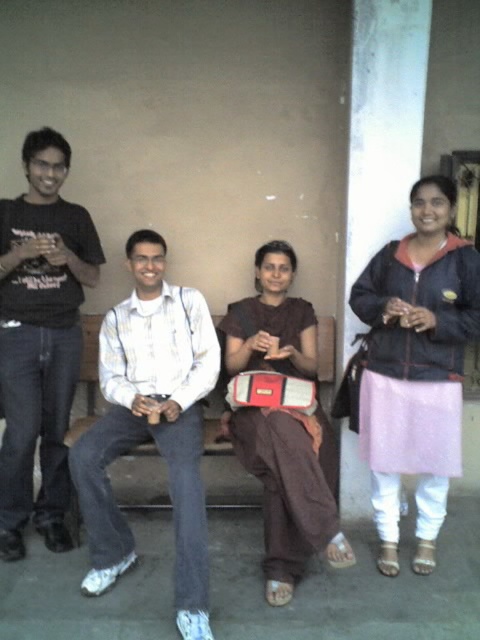
Question: Observing the image, what is the correct spatial positioning of white striped shirt at center in reference to brown fabric at center?

Choices:
 (A) above
 (B) below

Answer: (B)

Question: Among these objects, which one is nearest to the camera?

Choices:
 (A) brown fabric at center
 (B) white striped shirt at center
 (C) pink fabric skirt at right
 (D) black matte shirt at left

Answer: (B)

Question: Is black matte shirt at left positioned before brown fabric at center?

Choices:
 (A) no
 (B) yes

Answer: (A)

Question: Does black matte shirt at left have a larger size compared to brown fabric at center?

Choices:
 (A) yes
 (B) no

Answer: (B)

Question: Which of the following is the closest to the observer?

Choices:
 (A) click(371, 342)
 (B) click(170, 404)
 (C) click(54, 524)
 (D) click(286, 472)

Answer: (D)

Question: Among these points, which one is nearest to the camera?

Choices:
 (A) (381, 500)
 (B) (164, 385)
 (C) (313, 342)

Answer: (A)